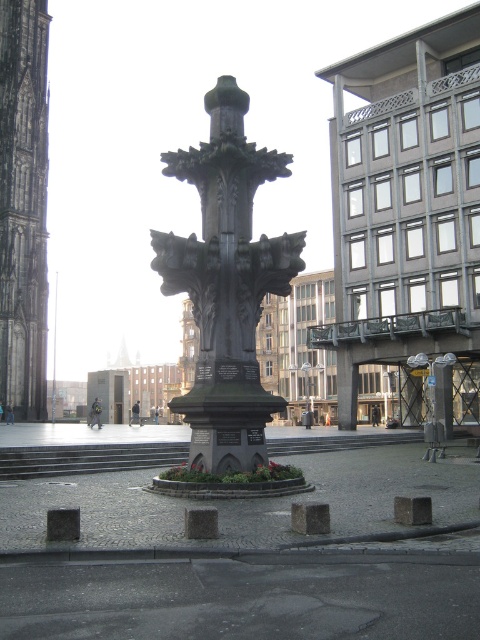
You are standing in the public square and want to take a photo of both the monument and the flower bed. You notice two points marked on the ground at coordinates point (263, 292) and point (26, 330). Which point should you stand closer to ensure both the monument and the flower bed are in focus?

You should stand closer to point (263, 292) because it is closer to the camera, allowing both the monument and the flower bed to be in focus.

You are standing in the public square and want to take a photo of the dark gray stone fountain at center and the dark gray stone tower at left. Which one should you focus on first if you want to capture both in the same frame without moving the camera?

You should focus on the dark gray stone fountain at center first because it is closer to the viewer than the dark gray stone tower at left, so it will be in focus if you adjust the camera to its distance.

You are a tourist standing at the edge of the square and want to take a photo of both the dark gray stone fountain at center and the dark gray stone tower at left. Which one should you focus on first if you want to include both in your frame without moving your camera?

You should focus on the dark gray stone tower at left first because it is taller than the dark gray stone fountain at center, allowing both to fit within the frame when positioned properly.